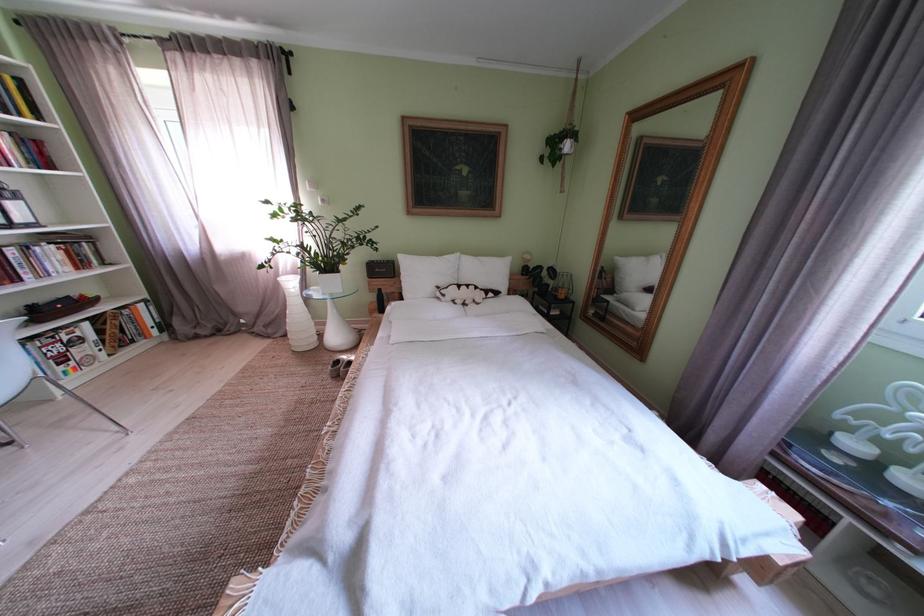
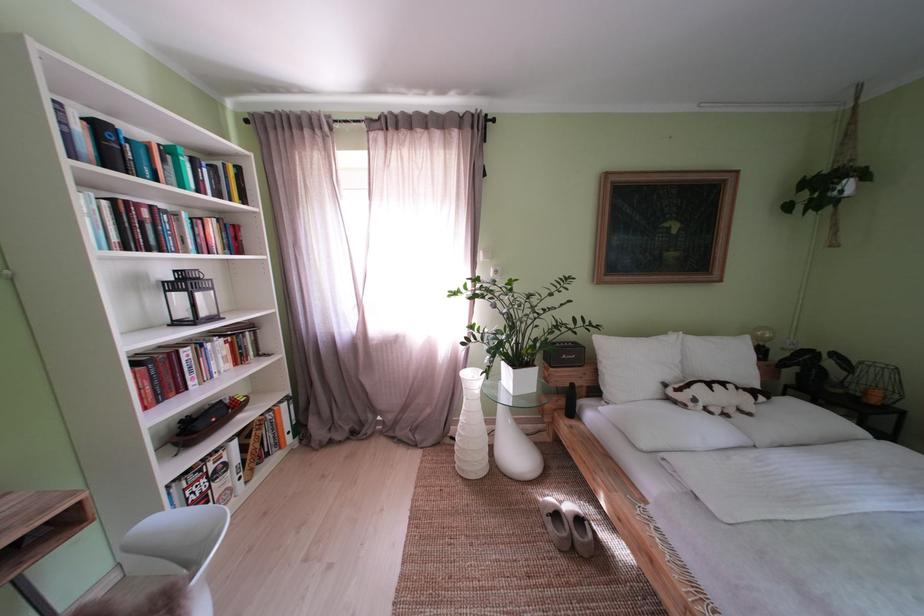
Locate, in the second image, the point that corresponds to (492,264) in the first image.

(723, 344)